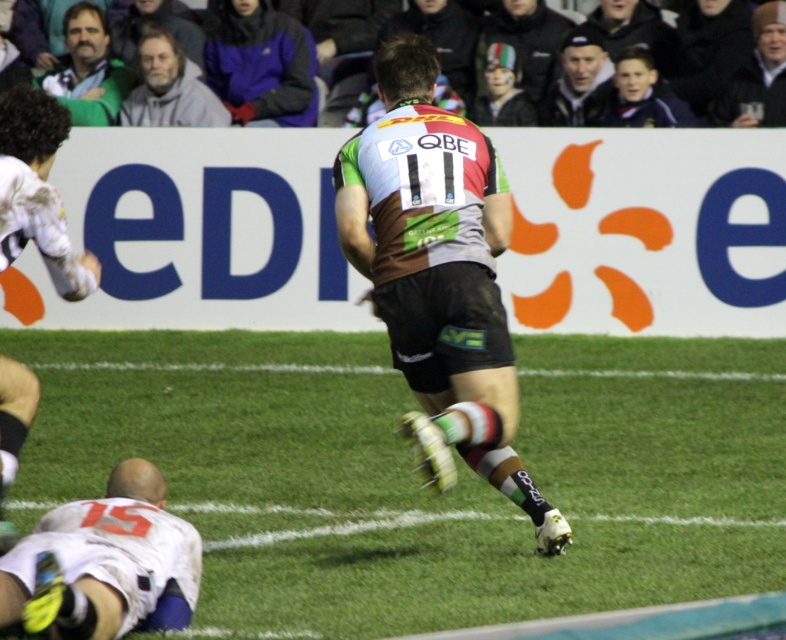
Between white fabric jersey at lower left and gray woolen sweater at upper left, which one appears on the left side from the viewer's perspective?

Positioned to the left is gray woolen sweater at upper left.

Which is more to the right, white fabric jersey at lower left or gray woolen sweater at upper left?

white fabric jersey at lower left is more to the right.

Which is behind, point (54, 611) or point (167, 32)?

Point (167, 32)

Where is `white fabric jersey at lower left`? The height and width of the screenshot is (640, 786). white fabric jersey at lower left is located at coordinates (103, 561).

Does green jersey at upper left have a smaller size compared to gray woolen sweater at upper left?

Actually, green jersey at upper left might be larger than gray woolen sweater at upper left.

Does green jersey at upper left come behind gray woolen sweater at upper left?

No, it is not.

The height and width of the screenshot is (640, 786). In order to click on green jersey at upper left in this screenshot , I will do `click(87, 68)`.

Who is taller, green jersey at upper left or black leather jacket at upper right?

Standing taller between the two is green jersey at upper left.

Is green jersey at upper left shorter than black leather jacket at upper right?

In fact, green jersey at upper left may be taller than black leather jacket at upper right.

This screenshot has height=640, width=786. What do you see at coordinates (87, 68) in the screenshot? I see `green jersey at upper left` at bounding box center [87, 68].

This screenshot has height=640, width=786. Identify the location of green jersey at upper left. (87, 68).